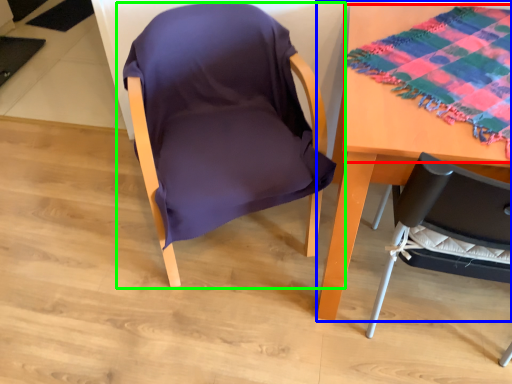
Question: Considering the real-world distances, which object is closest to blanket (highlighted by a red box)? table (highlighted by a blue box) or chair (highlighted by a green box).

Choices:
 (A) table
 (B) chair

Answer: (A)